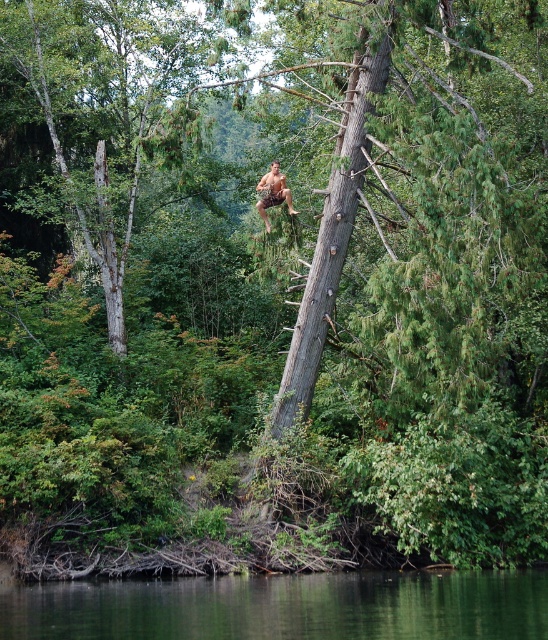
Question: Does green liquid water at lower center appear on the left side of brown textured shorts at center?

Choices:
 (A) yes
 (B) no

Answer: (A)

Question: Is gray rough bark tree trunk at center to the left of brown textured shorts at center from the viewer's perspective?

Choices:
 (A) no
 (B) yes

Answer: (A)

Question: Which object is the farthest from the gray rough bark tree trunk at center?

Choices:
 (A) green liquid water at lower center
 (B) brown textured shorts at center

Answer: (A)

Question: Which of the following is the closest to the observer?

Choices:
 (A) brown textured shorts at center
 (B) gray rough bark tree trunk at center

Answer: (B)

Question: Which point is closer to the camera?

Choices:
 (A) (356, 177)
 (B) (256, 205)
 (C) (286, 636)

Answer: (C)

Question: Is green liquid water at lower center behind brown textured shorts at center?

Choices:
 (A) yes
 (B) no

Answer: (B)